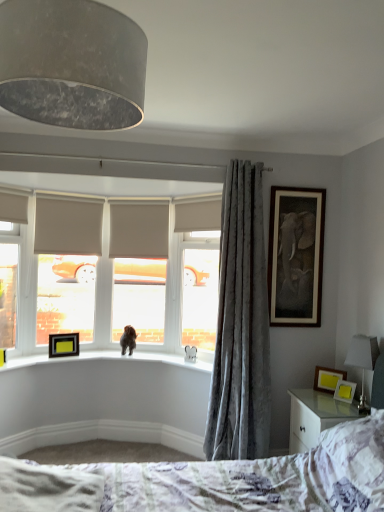
Question: Considering the relative sizes of matte gray roller blind at center, the 1th window screen viewed from the right, and wooden photo frame at right, which is the second picture frame in front-to-back order, in the image provided, is matte gray roller blind at center, the 1th window screen viewed from the right, bigger than wooden photo frame at right, which is the second picture frame in front-to-back order,?

Choices:
 (A) no
 (B) yes

Answer: (B)

Question: From a real-world perspective, is matte gray roller blind at center, which appears as the second window screen when viewed from the left, on wooden photo frame at right, arranged as the third picture frame when viewed from the back?

Choices:
 (A) yes
 (B) no

Answer: (A)

Question: Considering the relative positions of matte gray roller blind at center, the 1th window screen viewed from the right, and wooden photo frame at right, placed as the third picture frame when sorted from top to bottom, in the image provided, is matte gray roller blind at center, the 1th window screen viewed from the right, to the right of wooden photo frame at right, placed as the third picture frame when sorted from top to bottom, from the viewer's perspective?

Choices:
 (A) yes
 (B) no

Answer: (B)

Question: From the image's perspective, is matte gray roller blind at center, which appears as the second window screen when viewed from the left, under wooden photo frame at right, arranged as the third picture frame when viewed from the back?

Choices:
 (A) yes
 (B) no

Answer: (B)

Question: Does matte gray roller blind at center, which appears as the second window screen when viewed from the left, touch wooden photo frame at right, arranged as the third picture frame when viewed from the back?

Choices:
 (A) yes
 (B) no

Answer: (B)

Question: Considering the positions of point (51, 494) and point (190, 350), is point (51, 494) closer or farther from the camera than point (190, 350)?

Choices:
 (A) closer
 (B) farther

Answer: (A)

Question: Relative to white plush elephant at window, which is the 1th animal from right to left, is white textured sheet at lower left in front or behind?

Choices:
 (A) behind
 (B) front

Answer: (B)

Question: Considering the relative positions of white textured sheet at lower left and white plush elephant at window, which is the 1th animal from right to left, in the image provided, is white textured sheet at lower left to the left or to the right of white plush elephant at window, which is the 1th animal from right to left,?

Choices:
 (A) left
 (B) right

Answer: (A)

Question: Looking at their shapes, would you say white textured sheet at lower left is wider or thinner than white plush elephant at window, acting as the first animal starting from the front?

Choices:
 (A) thin
 (B) wide

Answer: (B)

Question: From the image's perspective, is fluffy white bed at lower center located above or below white plush elephant at window, acting as the first animal starting from the front?

Choices:
 (A) above
 (B) below

Answer: (B)

Question: Is fluffy white bed at lower center spatially inside white plush elephant at window, which is the 1th animal from right to left, or outside of it?

Choices:
 (A) inside
 (B) outside

Answer: (B)

Question: Considering the positions of fluffy white bed at lower center and white plush elephant at window, marked as the 2th animal in a back-to-front arrangement, in the image, is fluffy white bed at lower center wider or thinner than white plush elephant at window, marked as the 2th animal in a back-to-front arrangement,?

Choices:
 (A) thin
 (B) wide

Answer: (B)

Question: Relative to white plush elephant at window, marked as the 2th animal in a back-to-front arrangement, is fluffy white bed at lower center in front or behind?

Choices:
 (A) front
 (B) behind

Answer: (A)

Question: Choose the correct answer: Is black matte picture frame at upper left, marked as the 3th picture frame in a bottom-to-top arrangement, inside matte gray lampshade at upper left or outside it?

Choices:
 (A) inside
 (B) outside

Answer: (B)

Question: From a real-world perspective, relative to matte gray lampshade at upper left, is black matte picture frame at upper left, marked as the 3th picture frame in a bottom-to-top arrangement, vertically above or below?

Choices:
 (A) above
 (B) below

Answer: (B)